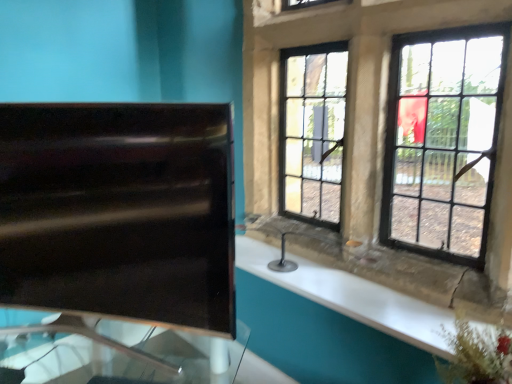
The width and height of the screenshot is (512, 384). Describe the element at coordinates (387, 136) in the screenshot. I see `black glass window at upper right` at that location.

Where is `transparent glass table at left`? The image size is (512, 384). transparent glass table at left is located at coordinates (106, 352).

The image size is (512, 384). I want to click on black glass window at upper right, so click(x=387, y=136).

Is black glass window at upper right wider or thinner than black glossy sink at left?

Considering their sizes, black glass window at upper right looks broader than black glossy sink at left.

Does point (312, 114) come behind point (158, 197)?

Yes.

From the image's perspective, which is below, black glass window at upper right or black glossy sink at left?

black glossy sink at left.

From a real-world perspective, which is physically above, black glossy sink at left or white glossy counter top at right?

black glossy sink at left is physically above.

Considering the positions of point (172, 143) and point (321, 280), is point (172, 143) closer or farther from the camera than point (321, 280)?

Point (172, 143) is closer to the camera than point (321, 280).

Identify the location of counter top located behind the black glossy sink at left. (353, 297).

Between transparent glass table at left and black glass window at upper right, which one appears on the right side from the viewer's perspective?

black glass window at upper right.

Which object is more forward, transparent glass table at left or black glass window at upper right?

transparent glass table at left is closer to the camera.

Looking at this image, how much distance is there between transparent glass table at left and black glass window at upper right?

A distance of 36.29 inches exists between transparent glass table at left and black glass window at upper right.

Is point (158, 377) farther from camera compared to point (424, 284)?

No, it is in front of (424, 284).

Does point (105, 344) come in front of point (104, 375)?

Yes, it is.

Between black glossy sink at left and transparent glass table at left, which one appears on the left side from the viewer's perspective?

Positioned to the left is transparent glass table at left.

Does black glossy sink at left have a greater width compared to transparent glass table at left?

No.

Relative to transparent glass table at left, is black glossy sink at left in front or behind?

black glossy sink at left is positioned farther from the viewer than transparent glass table at left.

Considering the relative sizes of white glossy counter top at right and black glass window at upper right in the image provided, is white glossy counter top at right smaller than black glass window at upper right?

Indeed, white glossy counter top at right has a smaller size compared to black glass window at upper right.

Considering the sizes of objects white glossy counter top at right and black glass window at upper right in the image provided, who is wider, white glossy counter top at right or black glass window at upper right?

Wider between the two is white glossy counter top at right.

The image size is (512, 384). I want to click on counter top below the black glass window at upper right (from the image's perspective), so click(353, 297).

From a real-world perspective, relative to black glass window at upper right, is white glossy counter top at right vertically above or below?

white glossy counter top at right is situated lower than black glass window at upper right in the real world.

Is black glossy sink at left taller or shorter than black glass window at upper right?

Considering their sizes, black glossy sink at left has less height than black glass window at upper right.

Is black glossy sink at left thinner than black glass window at upper right?

Correct, the width of black glossy sink at left is less than that of black glass window at upper right.

From the image's perspective, which one is positioned higher, black glossy sink at left or black glass window at upper right?

From the image's view, black glass window at upper right is above.

Is point (39, 169) positioned in front of point (272, 202)?

That is True.

From the image's perspective, between white glossy counter top at right and black glossy sink at left, who is located below?

From the image's view, white glossy counter top at right is below.

Which object is wider, white glossy counter top at right or black glossy sink at left?

Wider between the two is white glossy counter top at right.

Are white glossy counter top at right and black glossy sink at left located far from each other?

white glossy counter top at right is actually quite close to black glossy sink at left.

Is white glossy counter top at right positioned behind black glossy sink at left?

Yes, the depth of white glossy counter top at right is greater than that of black glossy sink at left.

The image size is (512, 384). I want to click on window lying in front of the black glossy sink at left, so click(x=387, y=136).

Where is `sink located above the white glossy counter top at right (from a real-world perspective)`? The image size is (512, 384). sink located above the white glossy counter top at right (from a real-world perspective) is located at coordinates (120, 217).

Based on their spatial positions, is white glossy counter top at right or transparent glass table at left further from black glass window at upper right?

transparent glass table at left.

Which object lies nearer to the anchor point black glass window at upper right, transparent glass table at left or white glossy counter top at right?

white glossy counter top at right is closer to black glass window at upper right.

From the picture: Estimate the real-world distances between objects in this image. Which object is further from black glossy sink at left, white glossy counter top at right or transparent glass table at left?

The object further to black glossy sink at left is white glossy counter top at right.

Considering their positions, is black glass window at upper right positioned closer to black glossy sink at left than white glossy counter top at right?

Among the two, white glossy counter top at right is located nearer to black glossy sink at left.

Estimate the real-world distances between objects in this image. Which object is closer to black glass window at upper right, black glossy sink at left or white glossy counter top at right?

white glossy counter top at right.

Consider the image. Based on their spatial positions, is black glass window at upper right or black glossy sink at left further from transparent glass table at left?

black glass window at upper right lies further to transparent glass table at left than the other object.

Estimate the real-world distances between objects in this image. Which object is further from transparent glass table at left, black glossy sink at left or white glossy counter top at right?

white glossy counter top at right is positioned further to the anchor transparent glass table at left.

Based on their spatial positions, is black glass window at upper right or black glossy sink at left closer to white glossy counter top at right?

black glass window at upper right lies closer to white glossy counter top at right than the other object.

The height and width of the screenshot is (384, 512). In order to click on sink located between transparent glass table at left and black glass window at upper right in the left-right direction in this screenshot , I will do `click(120, 217)`.

You are a GUI agent. You are given a task and a screenshot of the screen. Output one action in this format:
    pyautogui.click(x=<x>, y=<y>)
    Task: Click on the counter top between transparent glass table at left and black glass window at upper right
    
    Given the screenshot: What is the action you would take?
    pyautogui.click(x=353, y=297)

The width and height of the screenshot is (512, 384). Find the location of `counter top between black glossy sink at left and black glass window at upper right`. counter top between black glossy sink at left and black glass window at upper right is located at coordinates (353, 297).

Where is `sink situated between transparent glass table at left and white glossy counter top at right from left to right`? This screenshot has height=384, width=512. sink situated between transparent glass table at left and white glossy counter top at right from left to right is located at coordinates (120, 217).